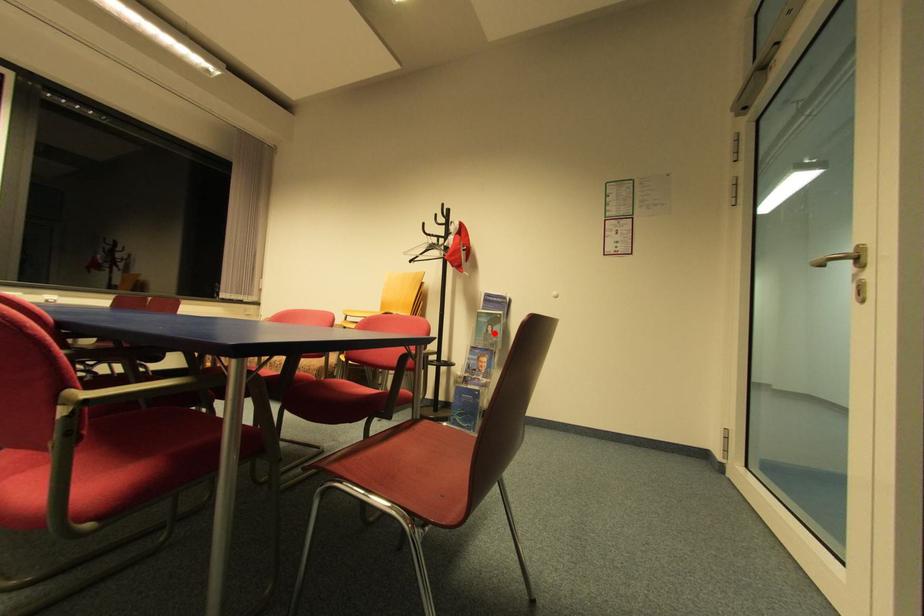
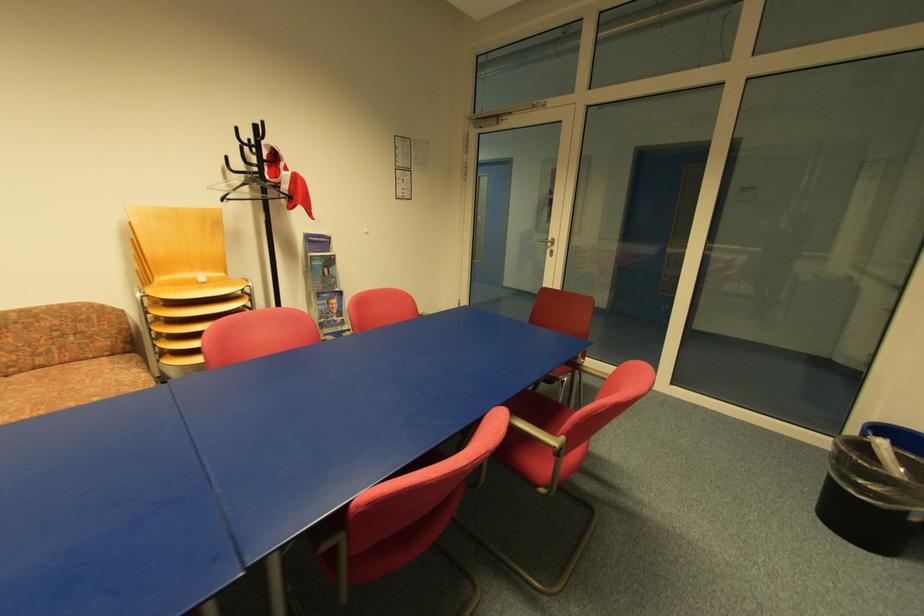
Find the pixel in the second image that matches the highlighted location in the first image.

(331, 275)